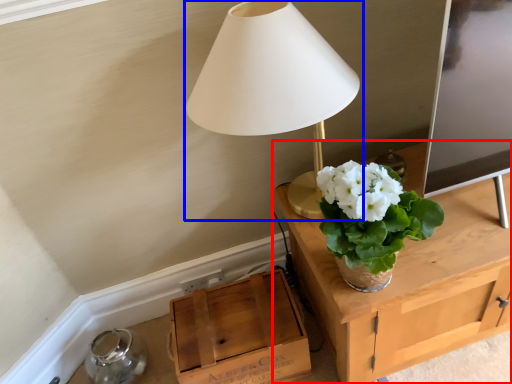
Question: Among these objects, which one is farthest to the camera, table (highlighted by a red box) or lamp (highlighted by a blue box)?

Choices:
 (A) table
 (B) lamp

Answer: (A)